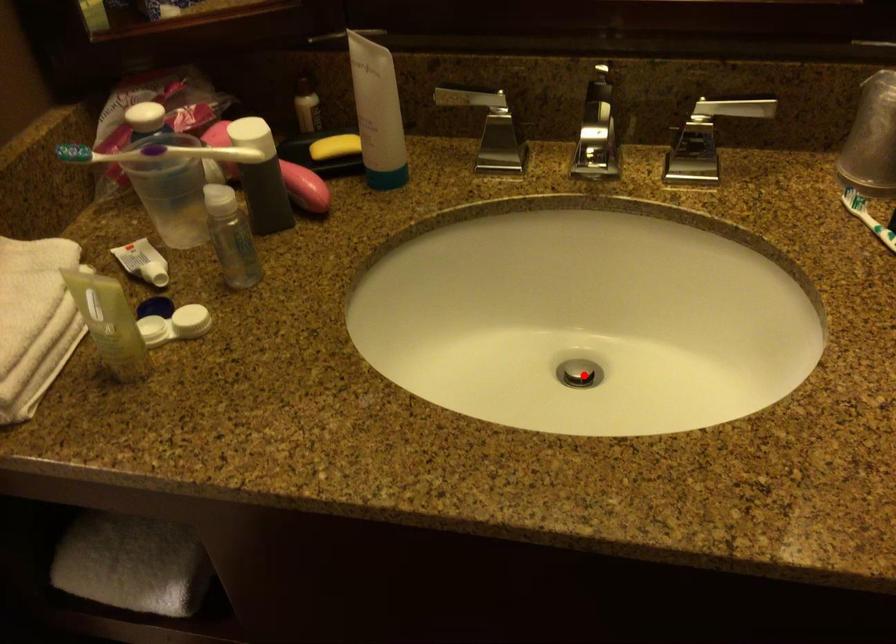
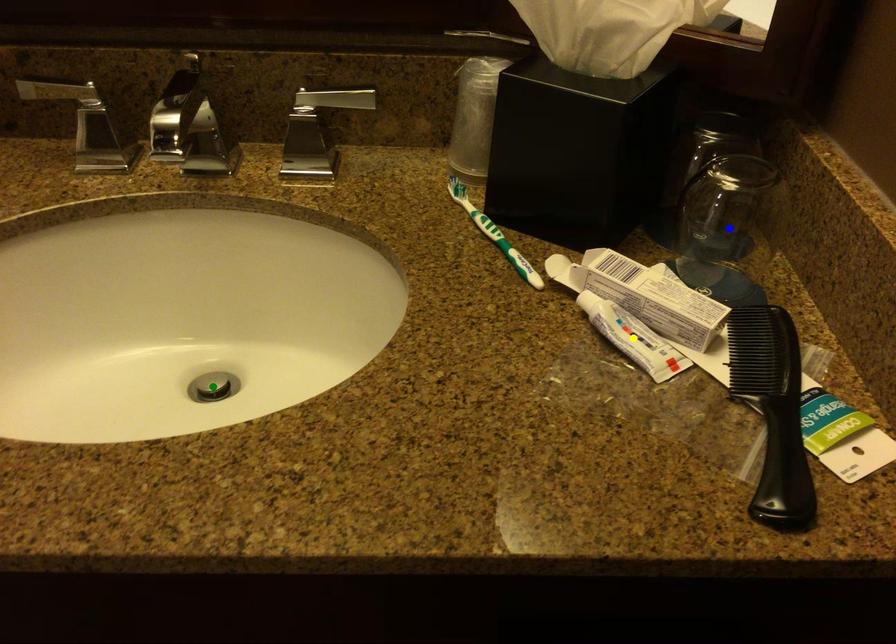
Question: I am providing you with two images of the same scene from different viewpoints. A red point is marked on the first image. You are given multiple points on the second image. Which point in image 2 is actually the same real-world point as the red point in image 1?

Choices:
 (A) blue point
 (B) yellow point
 (C) green point

Answer: (C)